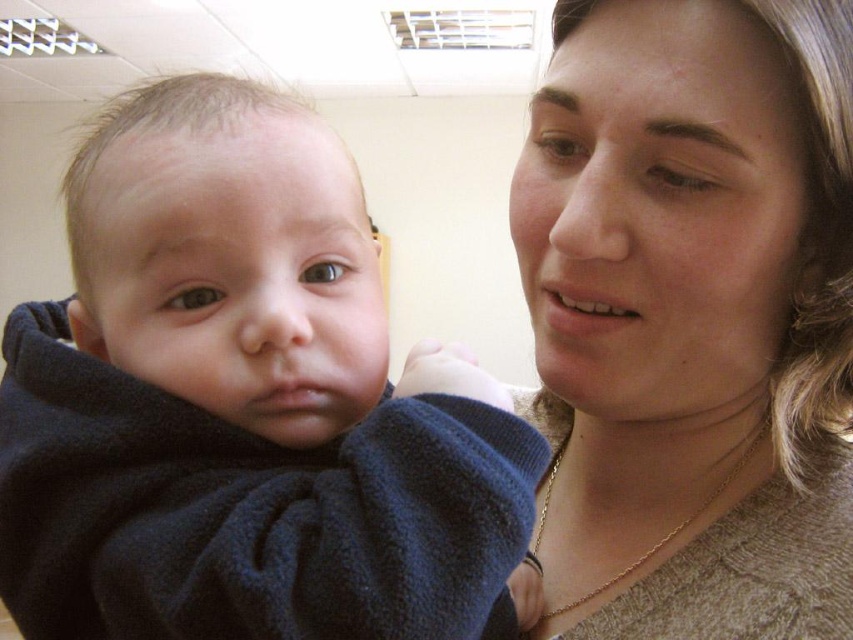
Locate an element on the screen. dark blue fleece at center is located at coordinates (247, 404).

Between dark blue fleece at center and matte beige sweater at center, which one appears on the right side from the viewer's perspective?

Positioned to the right is matte beige sweater at center.

Where is `dark blue fleece at center`? This screenshot has height=640, width=853. dark blue fleece at center is located at coordinates (247, 404).